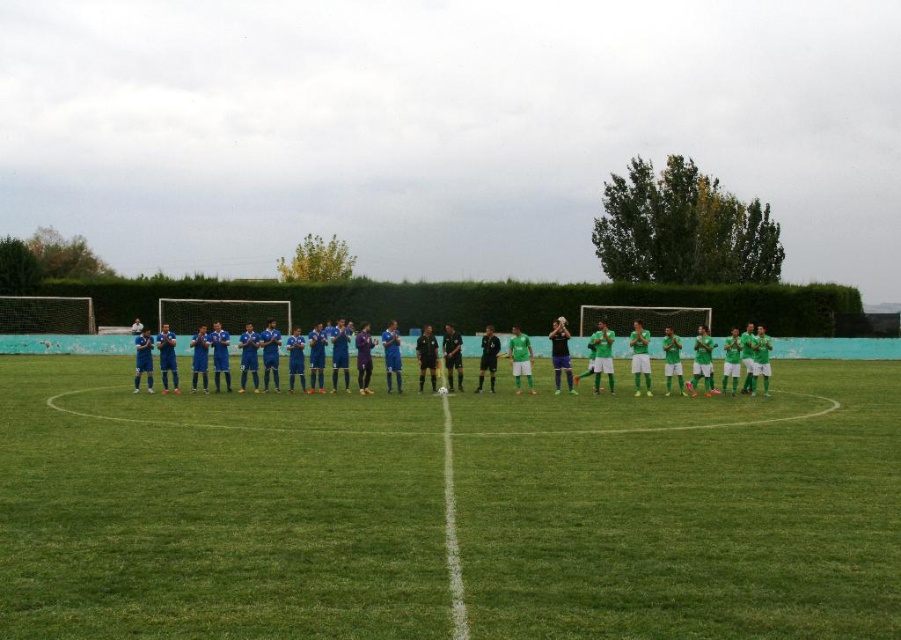
Question: Which point is closer to the camera?

Choices:
 (A) (271, 579)
 (B) (333, 326)

Answer: (A)

Question: Is green grass football field at center wider than blue matte soccer team at center?

Choices:
 (A) no
 (B) yes

Answer: (A)

Question: Does green grass football field at center appear over blue matte soccer team at center?

Choices:
 (A) no
 (B) yes

Answer: (A)

Question: Among these points, which one is nearest to the camera?

Choices:
 (A) (683, 392)
 (B) (572, 598)

Answer: (B)

Question: Which point is closer to the camera?

Choices:
 (A) pyautogui.click(x=38, y=477)
 (B) pyautogui.click(x=663, y=344)

Answer: (A)

Question: Can you confirm if green grass football field at center is positioned above blue matte soccer team at center?

Choices:
 (A) no
 (B) yes

Answer: (A)